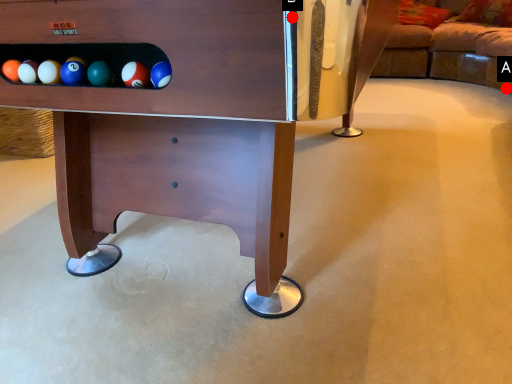
Question: Two points are circled on the image, labeled by A and B beside each circle. Which point is closer to the camera?

Choices:
 (A) A is closer
 (B) B is closer

Answer: (B)